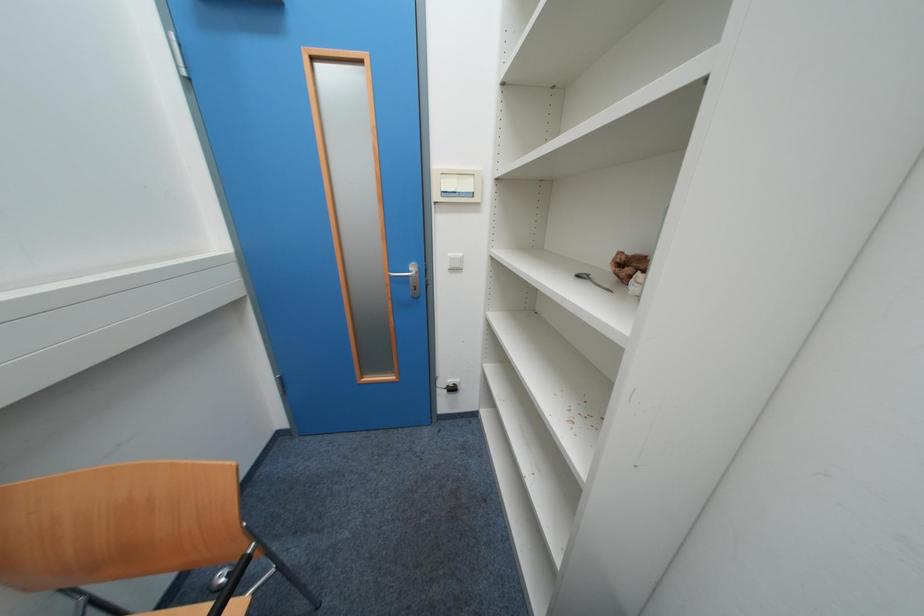
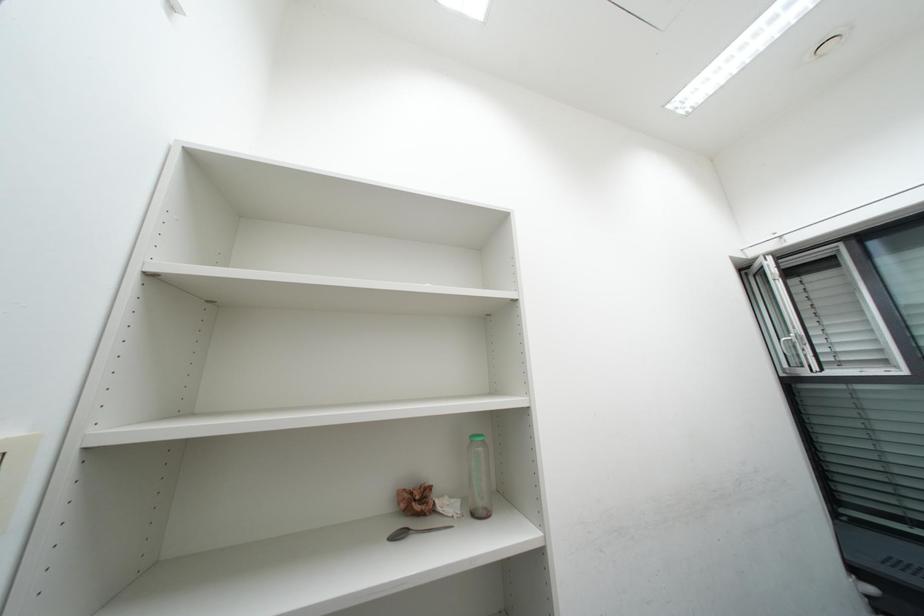
Question: How did the camera likely rotate?

Choices:
 (A) Left
 (B) Right
 (C) Up
 (D) Down

Answer: (B)